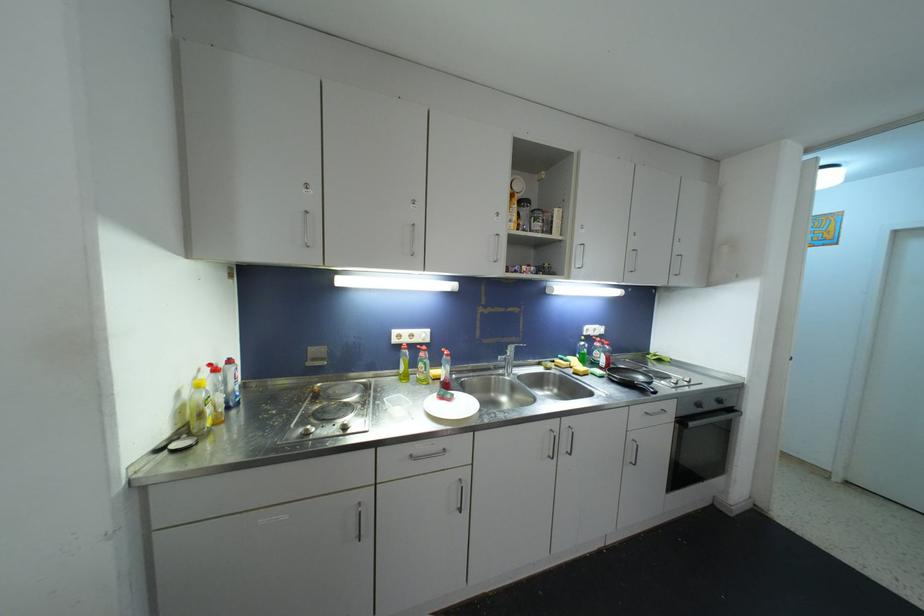
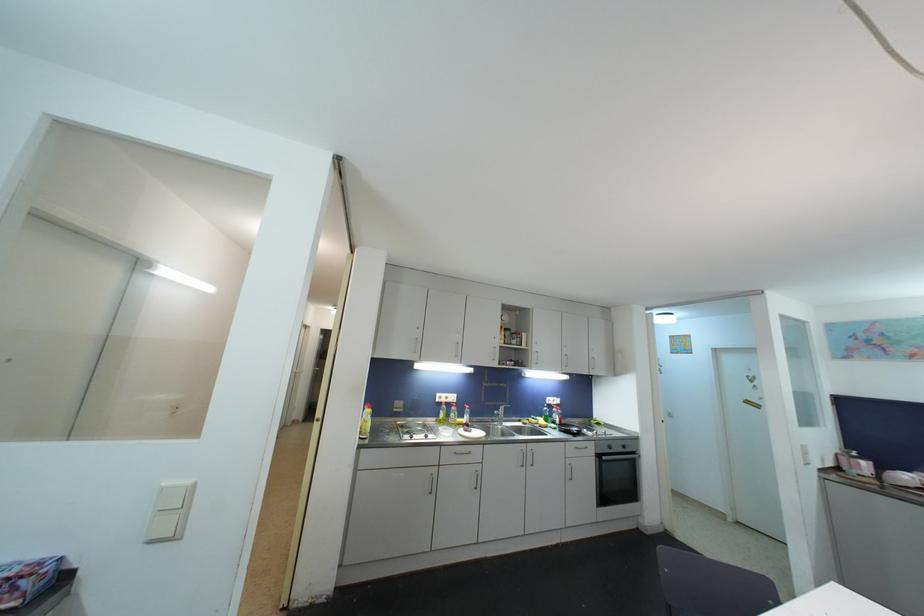
Locate, in the second image, the point that corresponds to [397,342] in the first image.

(441, 403)